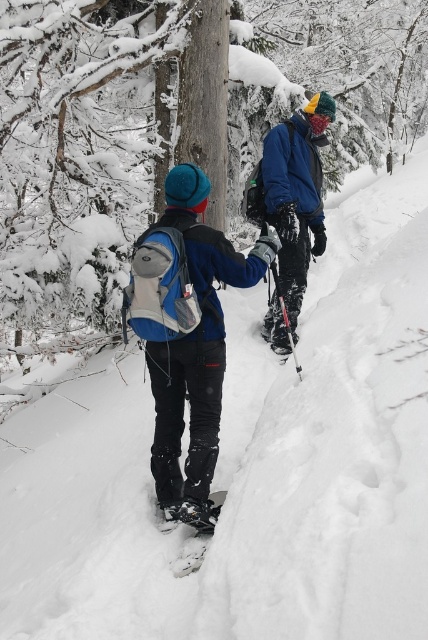
Question: Can you confirm if matte blue jacket at center is smaller than black matte ski at lower center?

Choices:
 (A) yes
 (B) no

Answer: (B)

Question: Which of these objects is positioned farthest from the matte blue jacket at center?

Choices:
 (A) black matte ski at lower center
 (B) blue matte jacket at center

Answer: (B)

Question: Among these points, which one is nearest to the camera?

Choices:
 (A) (177, 564)
 (B) (196, 355)
 (C) (284, 339)

Answer: (A)

Question: Observing the image, what is the correct spatial positioning of matte blue jacket at center in reference to black matte ski at lower center?

Choices:
 (A) above
 (B) below

Answer: (A)

Question: Is matte blue jacket at center wider than black matte ski at lower center?

Choices:
 (A) no
 (B) yes

Answer: (B)

Question: Among these objects, which one is nearest to the camera?

Choices:
 (A) blue matte jacket at center
 (B) black matte ski at lower center
 (C) matte blue jacket at center

Answer: (C)